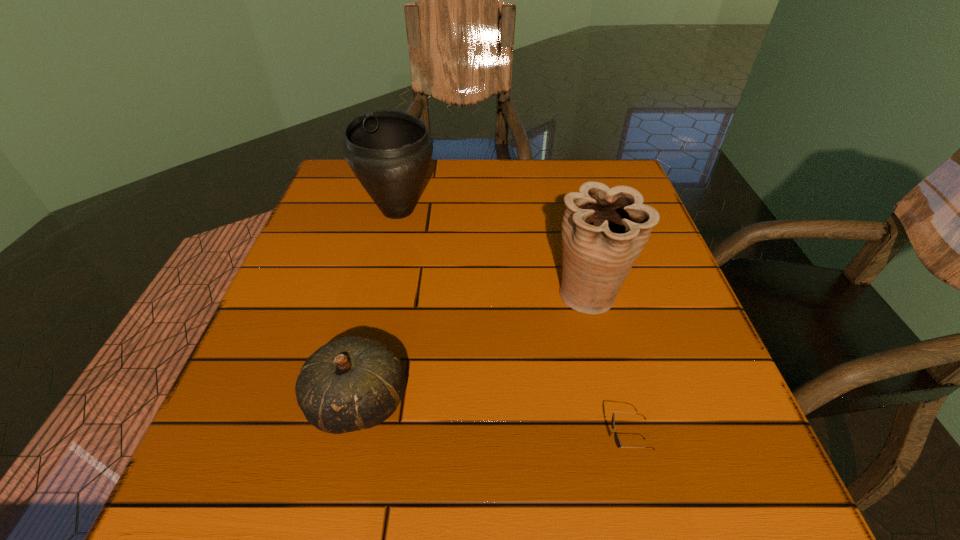
The width and height of the screenshot is (960, 540). I want to click on free space between the shortest object and the nearer urn, so [x=608, y=370].

Identify the location of empty space that is in between the third nearest object and the farthest object. The image size is (960, 540). (493, 253).

The image size is (960, 540). In order to click on empty space that is in between the nearer urn and the sunglasses in this screenshot , I will do `click(608, 370)`.

In order to click on free space between the right urn and the gourd in this screenshot , I will do `click(474, 348)`.

Locate an element on the screen. The height and width of the screenshot is (540, 960). free space between the farthest object and the sunglasses is located at coordinates (512, 328).

At what (x,y) coordinates should I click in order to perform the action: click on vacant area that lies between the farther urn and the sunglasses. Please return your answer as a coordinate pair (x, y). This screenshot has width=960, height=540. Looking at the image, I should click on (512, 328).

Identify the location of object that stands as the closest to the sunglasses. Image resolution: width=960 pixels, height=540 pixels. (604, 230).

This screenshot has width=960, height=540. In order to click on object that is the second nearest to the shortest object in this screenshot , I will do `click(352, 383)`.